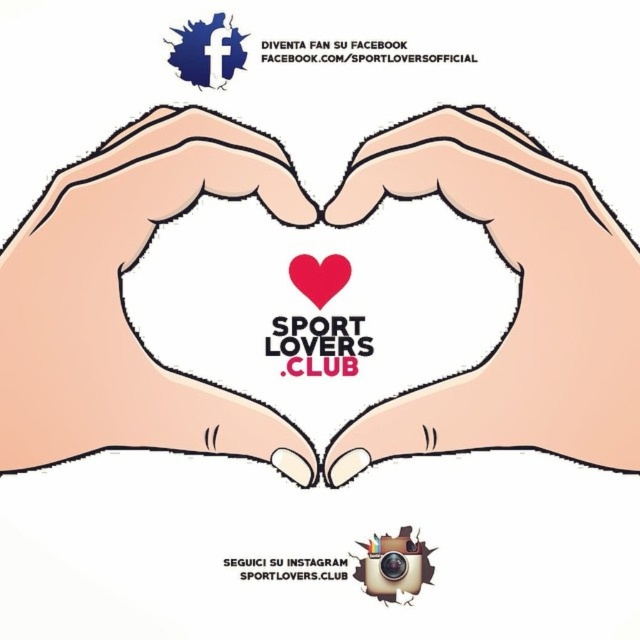
Question: In this image, where is pink matte heart at center located relative to matte red heart at center?

Choices:
 (A) above
 (B) below

Answer: (B)

Question: Based on their relative distances, which object is farther from the matte red heart at center?

Choices:
 (A) smooth beige hand at center
 (B) pink matte heart at center
 (C) pink matte hands at center

Answer: (B)

Question: Which object appears closest to the camera in this image?

Choices:
 (A) smooth beige hand at center
 (B) pink matte hands at center
 (C) pink matte heart at center

Answer: (A)

Question: Which of the following is the closest to the observer?

Choices:
 (A) smooth beige hand at center
 (B) pink matte heart at center
 (C) matte red heart at center

Answer: (A)

Question: Does pink matte hands at center come behind smooth beige hand at center?

Choices:
 (A) yes
 (B) no

Answer: (A)

Question: Is smooth beige hand at center thinner than pink matte heart at center?

Choices:
 (A) yes
 (B) no

Answer: (A)